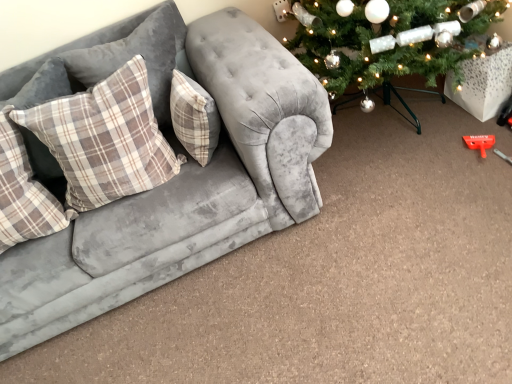
Question: From a real-world perspective, is velvet grey couch at left over plaid fabric pillow at left, acting as the 1th pillow starting from the left?

Choices:
 (A) yes
 (B) no

Answer: (B)

Question: Is plaid fabric pillow at left, acting as the 1th pillow starting from the left, at the back of velvet grey couch at left?

Choices:
 (A) no
 (B) yes

Answer: (B)

Question: From a real-world perspective, is velvet grey couch at left under plaid fabric pillow at left, acting as the 1th pillow starting from the left?

Choices:
 (A) yes
 (B) no

Answer: (A)

Question: Is velvet grey couch at left wider than plaid fabric pillow at left, which appears as the 4th pillow when viewed from the right?

Choices:
 (A) yes
 (B) no

Answer: (A)

Question: Considering the relative sizes of velvet grey couch at left and plaid fabric pillow at left, acting as the 1th pillow starting from the left, in the image provided, is velvet grey couch at left taller than plaid fabric pillow at left, acting as the 1th pillow starting from the left,?

Choices:
 (A) no
 (B) yes

Answer: (B)

Question: Is plaid fabric pillow at left, the 3th pillow in the right-to-left sequence, to the left or to the right of plaid fabric pillow at left, acting as the 1th pillow starting from the left, in the image?

Choices:
 (A) left
 (B) right

Answer: (B)

Question: From the image's perspective, is plaid fabric pillow at left, the 3th pillow in the right-to-left sequence, above or below plaid fabric pillow at left, which appears as the 4th pillow when viewed from the right?

Choices:
 (A) below
 (B) above

Answer: (B)

Question: Choose the correct answer: Is plaid fabric pillow at left, the 3th pillow in the right-to-left sequence, inside plaid fabric pillow at left, acting as the 1th pillow starting from the left, or outside it?

Choices:
 (A) outside
 (B) inside

Answer: (A)

Question: Is plaid fabric pillow at left, the 3th pillow in the right-to-left sequence, bigger or smaller than plaid fabric pillow at left, which appears as the 4th pillow when viewed from the right?

Choices:
 (A) big
 (B) small

Answer: (A)

Question: From a real-world perspective, is plaid fabric pillow at left, acting as the 1th pillow starting from the left, above or below plaid fabric pillow at left, the 3th pillow in the right-to-left sequence?

Choices:
 (A) above
 (B) below

Answer: (B)

Question: Is plaid fabric pillow at left, which appears as the 4th pillow when viewed from the right, in front of or behind plaid fabric pillow at left, the 3th pillow in the right-to-left sequence, in the image?

Choices:
 (A) front
 (B) behind

Answer: (A)

Question: Looking at their shapes, would you say plaid fabric pillow at left, acting as the 1th pillow starting from the left, is wider or thinner than plaid fabric pillow at left, the 3th pillow in the right-to-left sequence?

Choices:
 (A) thin
 (B) wide

Answer: (A)

Question: Is plaid fabric pillow at left, acting as the 1th pillow starting from the left, to the left or to the right of plaid fabric pillow at left, the 3th pillow in the right-to-left sequence, in the image?

Choices:
 (A) right
 (B) left

Answer: (B)

Question: Is velvet grey couch at left inside or outside of plaid fabric pillow at center, the first pillow in the right-to-left sequence?

Choices:
 (A) inside
 (B) outside

Answer: (B)

Question: Considering their positions, is velvet grey couch at left located in front of or behind plaid fabric pillow at center, placed as the 4th pillow when sorted from left to right?

Choices:
 (A) behind
 (B) front

Answer: (B)